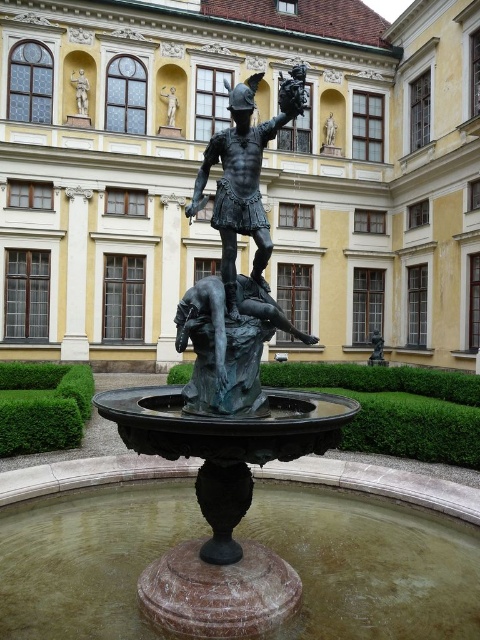
From the picture: Does yellow stone palace at center appear on the left side of matte gold statue at upper center?

Incorrect, yellow stone palace at center is not on the left side of matte gold statue at upper center.

Is yellow stone palace at center smaller than matte gold statue at upper center?

No, yellow stone palace at center is not smaller than matte gold statue at upper center.

At what (x,y) coordinates should I click in order to perform the action: click on yellow stone palace at center. Please return your answer as a coordinate pair (x, y). Looking at the image, I should click on (219, 172).

Is point (7, 42) positioned before point (84, 92)?

Yes, it is in front of point (84, 92).

Who is higher up, yellow stone palace at center or bronze statue at upper left?

bronze statue at upper left is higher up.

Does point (128, 81) lie in front of point (86, 81)?

That is False.

Find the location of a particular element. Image resolution: width=480 pixels, height=640 pixels. yellow stone palace at center is located at coordinates (219, 172).

Who is lower down, bronze statue at upper left or matte gold statue at upper center?

matte gold statue at upper center is below.

Between point (78, 86) and point (167, 93), which one is positioned behind?

Positioned behind is point (167, 93).

This screenshot has height=640, width=480. Identify the location of bronze statue at upper left. (81, 92).

Find the location of `bronze statue at upper left`. bronze statue at upper left is located at coordinates (81, 92).